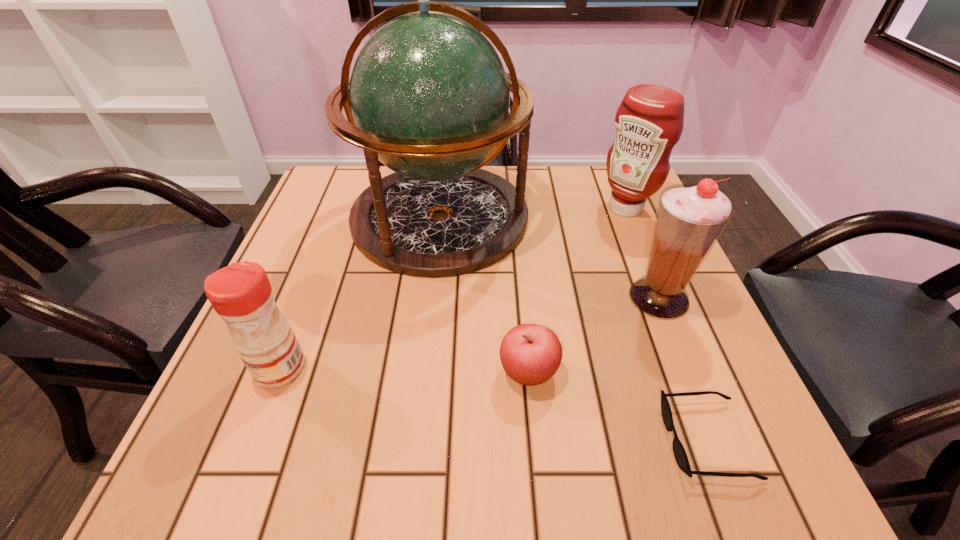
Identify the location of free region located 0.090m on the front of the right condiment. The image size is (960, 540). (641, 247).

You are a GUI agent. You are given a task and a screenshot of the screen. Output one action in this format:
    pyautogui.click(x=<x>, y=<y>)
    Task: Click on the free location located 0.380m on the left of the smoothie
    This screenshot has height=540, width=960.
    Given the screenshot: What is the action you would take?
    pyautogui.click(x=439, y=298)

I want to click on vacant space located 0.310m on the back of the left condiment, so click(x=330, y=238).

At what (x,y) coordinates should I click in order to perform the action: click on free space located 0.340m on the back of the fifth tallest object. Please return your answer as a coordinate pair (x, y). Looking at the image, I should click on (516, 232).

Locate an element on the screen. This screenshot has height=540, width=960. free space located on the front-facing side of the sunglasses is located at coordinates (439, 440).

The height and width of the screenshot is (540, 960). In order to click on free region located 0.140m on the front-facing side of the sunglasses in this screenshot , I will do [577, 440].

The height and width of the screenshot is (540, 960). I want to click on blank area located on the front-facing side of the sunglasses, so [x=419, y=440].

Where is `globe located at the far edge`? The image size is (960, 540). globe located at the far edge is located at coordinates (429, 97).

The height and width of the screenshot is (540, 960). I want to click on condiment that is at the far edge, so click(x=649, y=121).

Where is `object that is at the near edge`? object that is at the near edge is located at coordinates (680, 455).